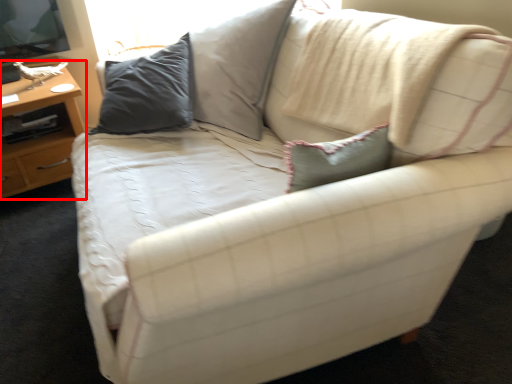
Question: Considering the relative positions of table (annotated by the red box) and pillow in the image provided, where is table (annotated by the red box) located with respect to the staircase?

Choices:
 (A) right
 (B) left

Answer: (B)